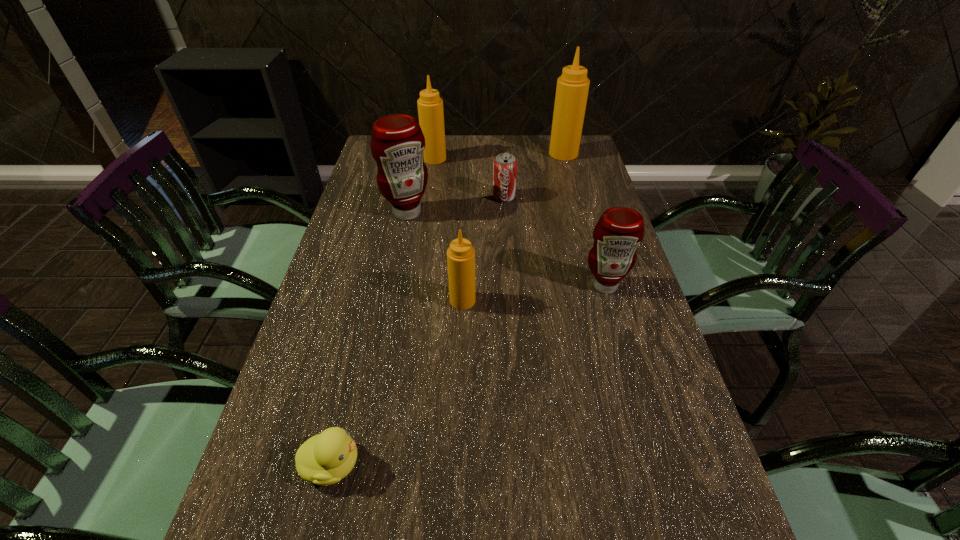
Find the location of a particular element. The height and width of the screenshot is (540, 960). soda can is located at coordinates (505, 165).

Find the location of `yellow duckling`. yellow duckling is located at coordinates (324, 459).

The image size is (960, 540). Find the location of `the shortest object`. the shortest object is located at coordinates (324, 459).

Locate an element on the screen. The height and width of the screenshot is (540, 960). free space located 0.060m on the front of the tallest condiment is located at coordinates (567, 170).

You are a GUI agent. You are given a task and a screenshot of the screen. Output one action in this format:
    pyautogui.click(x=<x>, y=<y>)
    Task: Click on the vacant point located on the back of the leftmost tan condiment
    The height and width of the screenshot is (540, 960).
    Given the screenshot: What is the action you would take?
    [x=437, y=141]

Identify the location of vacant space located 0.240m on the back of the farther red condiment. (418, 164).

Locate an element on the screen. Image resolution: width=960 pixels, height=540 pixels. vacant space situated on the right of the nearest tan condiment is located at coordinates (606, 301).

Image resolution: width=960 pixels, height=540 pixels. What are the coordinates of `vacant space located on the back of the smaller red condiment` in the screenshot? It's located at (589, 233).

Image resolution: width=960 pixels, height=540 pixels. I want to click on vacant region located 0.240m on the front of the pink soda can, so click(508, 253).

Locate an element on the screen. The image size is (960, 540). free region located at the beak of the duckling is located at coordinates (407, 464).